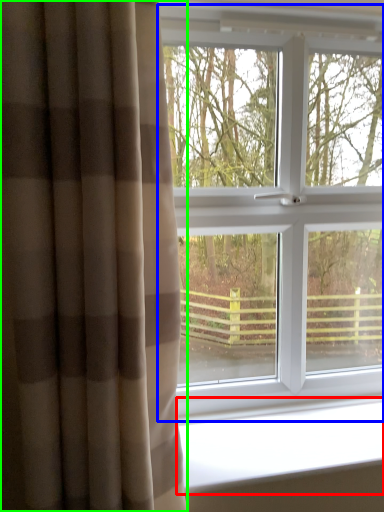
Question: Estimate the real-world distances between objects in this image. Which object is farther from window sill (highlighted by a red box), window (highlighted by a blue box) or curtain (highlighted by a green box)?

Choices:
 (A) window
 (B) curtain

Answer: (B)